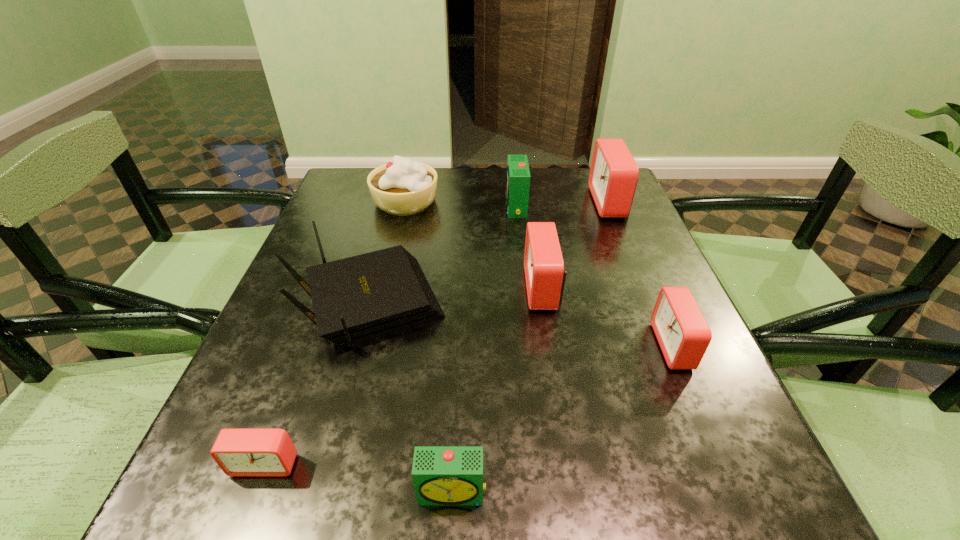
The image size is (960, 540). Identify the location of the farthest red alarm clock. (613, 175).

Locate an element on the screen. This screenshot has width=960, height=540. the biggest red alarm clock is located at coordinates (613, 175).

Where is `beige whipped cream`? The image size is (960, 540). beige whipped cream is located at coordinates (402, 187).

This screenshot has height=540, width=960. I want to click on black router, so click(356, 299).

In order to click on the right green alarm clock in this screenshot , I will do `click(518, 176)`.

This screenshot has height=540, width=960. Identify the location of the bigger green alarm clock. pyautogui.click(x=518, y=176).

At what (x,y) coordinates should I click in order to perform the action: click on the second red alarm clock from left to right. Please return your answer as a coordinate pair (x, y). Looking at the image, I should click on (545, 274).

Where is `the second biggest red alarm clock`? The height and width of the screenshot is (540, 960). the second biggest red alarm clock is located at coordinates (545, 274).

Image resolution: width=960 pixels, height=540 pixels. I want to click on the third nearest alarm clock, so click(x=683, y=334).

Where is `the third farthest red alarm clock`? the third farthest red alarm clock is located at coordinates (683, 334).